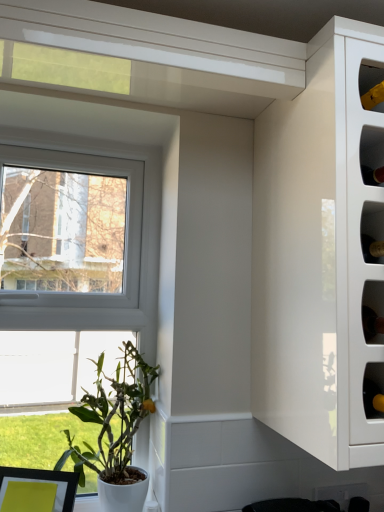
Question: Considering the positions of white glossy cabinet at upper right and green matte plant at lower left in the image, is white glossy cabinet at upper right wider or thinner than green matte plant at lower left?

Choices:
 (A) thin
 (B) wide

Answer: (B)

Question: Considering the positions of white glossy cabinet at upper right and green matte plant at lower left in the image, is white glossy cabinet at upper right bigger or smaller than green matte plant at lower left?

Choices:
 (A) big
 (B) small

Answer: (A)

Question: From the image's perspective, relative to green matte plant at lower left, is white glossy cabinet at upper right above or below?

Choices:
 (A) above
 (B) below

Answer: (A)

Question: From the image's perspective, is green matte plant at lower left positioned above or below white glossy cabinet at upper right?

Choices:
 (A) below
 (B) above

Answer: (A)

Question: Would you say green matte plant at lower left is to the left or to the right of white glossy cabinet at upper right in the picture?

Choices:
 (A) left
 (B) right

Answer: (A)

Question: From a real-world perspective, is green matte plant at lower left physically located above or below white glossy cabinet at upper right?

Choices:
 (A) below
 (B) above

Answer: (A)

Question: Considering the positions of green matte plant at lower left and white glossy cabinet at upper right in the image, is green matte plant at lower left taller or shorter than white glossy cabinet at upper right?

Choices:
 (A) short
 (B) tall

Answer: (A)